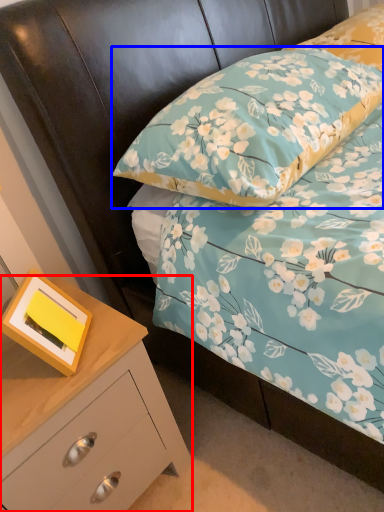
Question: Which object appears farthest to the camera in this image, chest of drawers (highlighted by a red box) or pillow (highlighted by a blue box)?

Choices:
 (A) chest of drawers
 (B) pillow

Answer: (B)